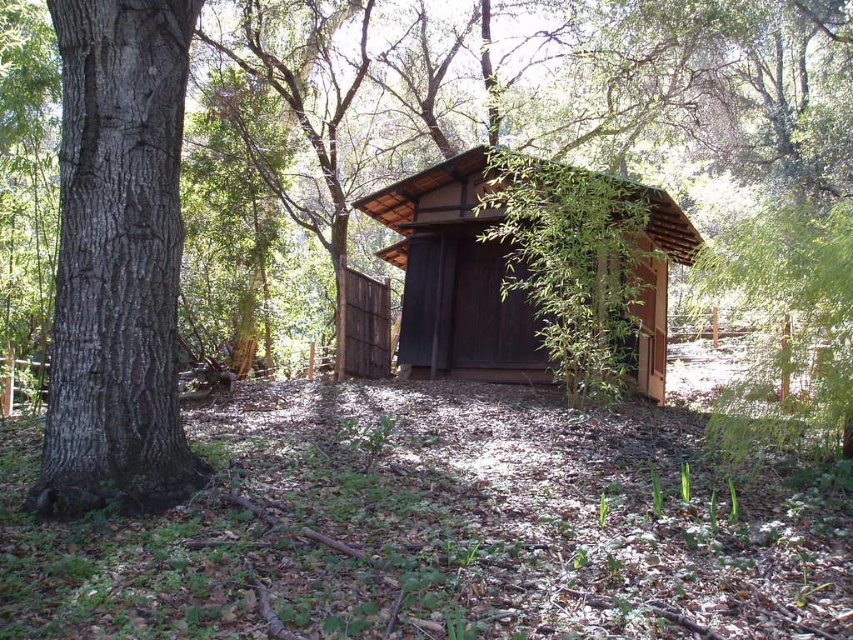
You are an architect designing a new cabin. You have a limited budget and must choose between placing a smooth brown bark at left or expanding the brown wooden cabin at center. Based on the current space they occupy, which object takes up more area and should be prioritized for expansion?

The brown wooden cabin at center occupies more space than the smooth brown bark at left, so it should be prioritized for expansion since it already takes up more area.

You are standing at the entrance of the rustic wooden cabin and want to place two markers at point (167, 340) and point (453, 168). Which marker will be closer to the cabin entrance?

Point (167, 340) is in front of point (453, 168), so the marker at point (167, 340) will be closer to the cabin entrance.

You are standing in front of the brown wooden cabin at center and looking towards the smooth brown bark at left. Which object is higher in elevation?

The smooth brown bark at left is higher in elevation than the brown wooden cabin at center because it is positioned above it.